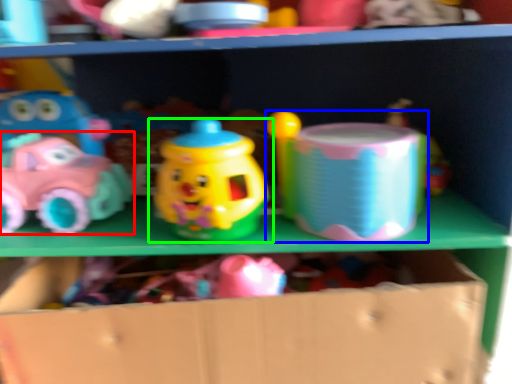
Question: Based on their relative distances, which object is nearer to toy (highlighted by a red box)? Choose from toy (highlighted by a blue box) and toy (highlighted by a green box).

Choices:
 (A) toy
 (B) toy

Answer: (B)